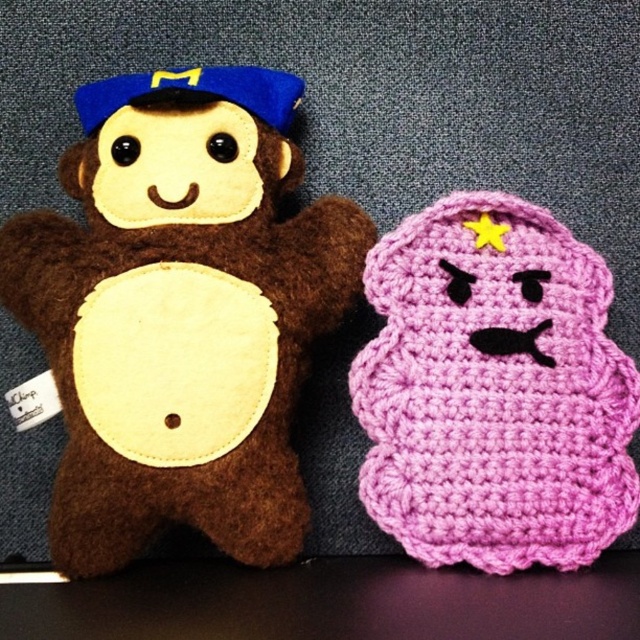
You are an interior designer arranging a childrens room. You have two plush toys to place on a shelf. The brown felt monkey at left and the crocheted purple star at right. The point given is at coordinate (180, 312). Which plush toy is located at that point?

The point at coordinate (180, 312) corresponds to the brown felt monkey at left.

You are placing a new toy on the shelf and need to know the exact position of the brown felt monkey at left. What are its coordinates?

The brown felt monkey at left is located at point [180,312].

You have a small box that can only fit items up to 10 inches wide. You need to place either the brown felt monkey at left or the crochet pink plush at right into the box. Based on their sizes, which toy can fit into the box?

The crochet pink plush at right can fit into the box since its width is smaller than the brown felt monkey at left, and the box can accommodate items up to 10 inches wide.